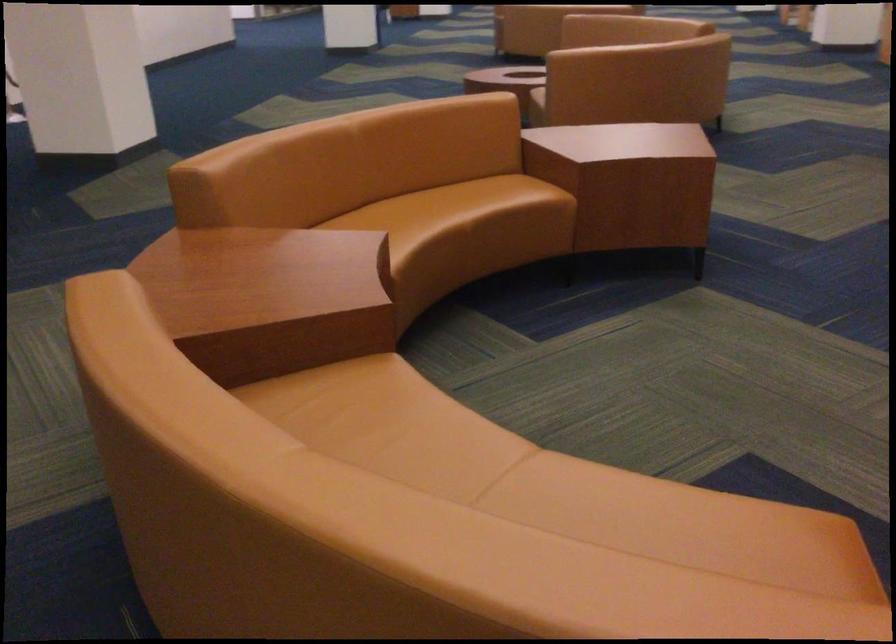
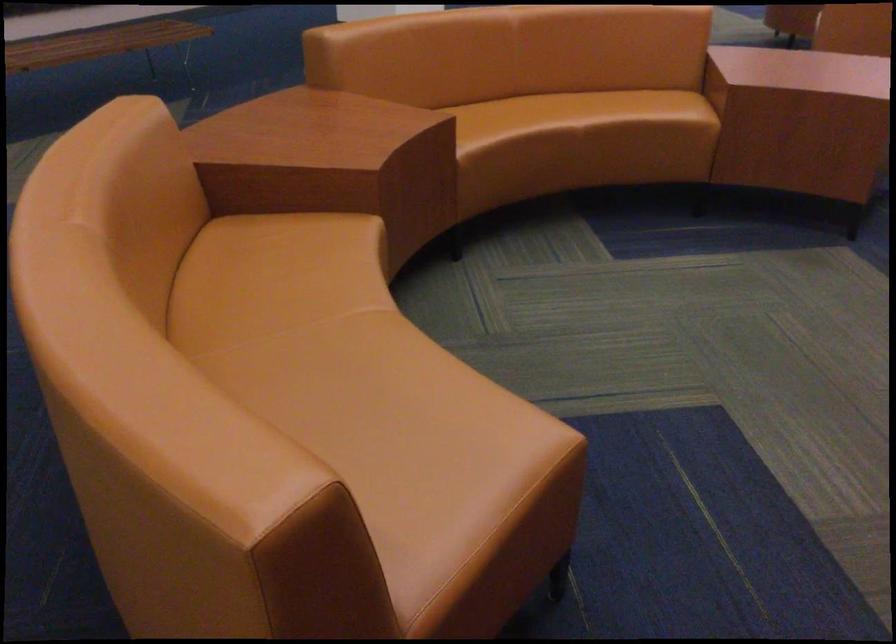
Question: Based on the continuous images, in which direction is the camera rotating? Reply with the corresponding letter.

Choices:
 (A) Left
 (B) Right
 (C) Up
 (D) Down

Answer: (A)